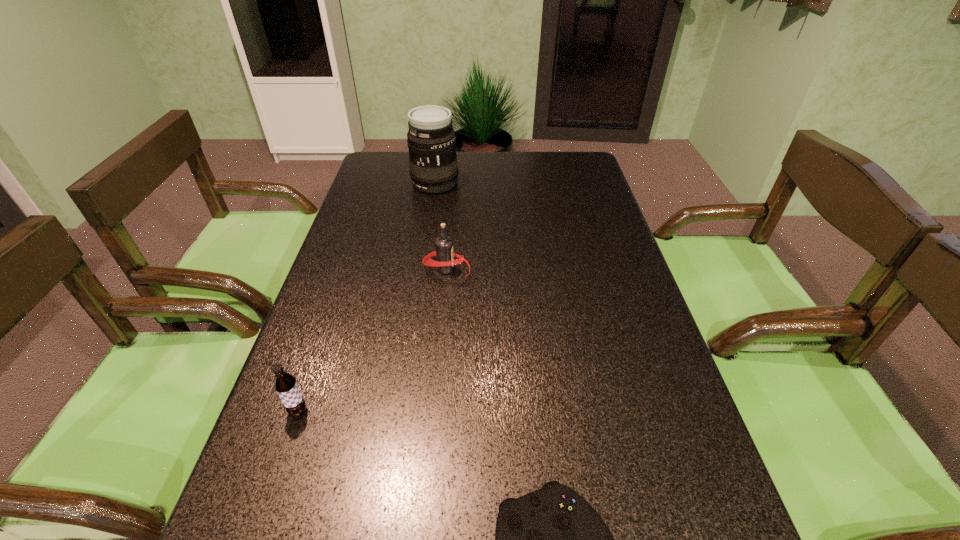
Identify which object is the closest to the third nearest object. Please provide its 2D coordinates. Your answer should be formatted as a tuple, i.e. [(x, y)], where the tuple contains the x and y coordinates of a point satisfying the conditions above.

[(354, 539)]

Identify which object is located as the third nearest to the rightmost object. Please provide its 2D coordinates. Your answer should be formatted as a tuple, i.e. [(x, y)], where the tuple contains the x and y coordinates of a point satisfying the conditions above.

[(444, 253)]

You are a GUI agent. You are given a task and a screenshot of the screen. Output one action in this format:
    pyautogui.click(x=<x>, y=<y>)
    Task: Click on the vacant space that satisfies the following two spatial constraints: 1. on the back side of the telephoto lens; 2. on the left side of the third farthest object
    This screenshot has width=960, height=540.
    Given the screenshot: What is the action you would take?
    pyautogui.click(x=376, y=183)